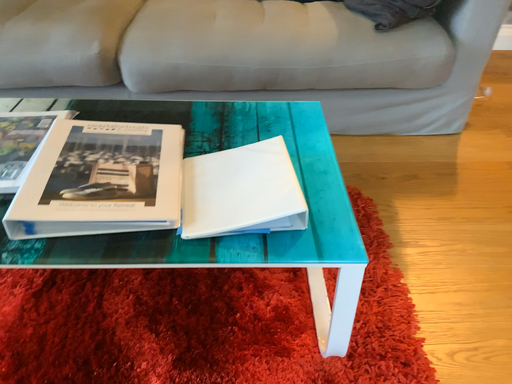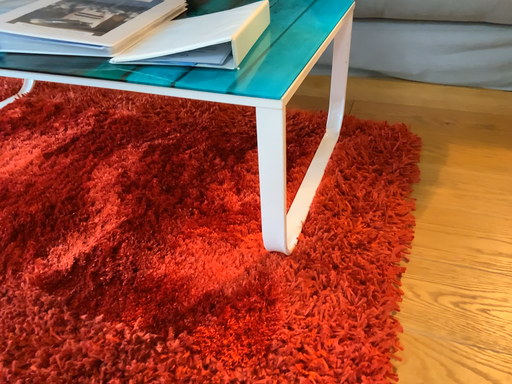
Question: Which way did the camera rotate in the video?

Choices:
 (A) rotated right
 (B) rotated left

Answer: (B)